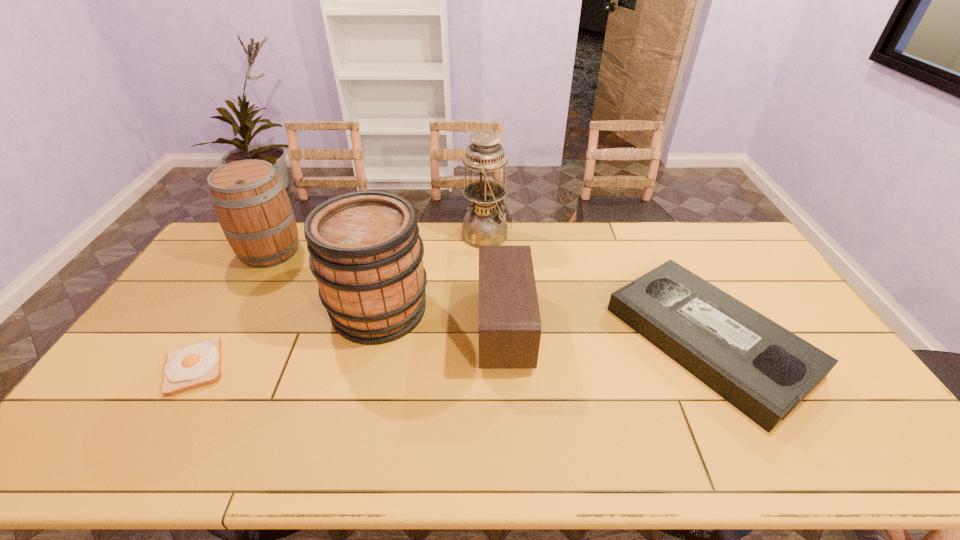
The image size is (960, 540). I want to click on toast located at the left edge, so click(188, 367).

The height and width of the screenshot is (540, 960). Find the location of `object present at the right edge`. object present at the right edge is located at coordinates (764, 370).

In order to click on object that is at the far left corner in this screenshot , I will do `click(252, 206)`.

Where is `object that is at the near right corner`? This screenshot has height=540, width=960. object that is at the near right corner is located at coordinates (764, 370).

Image resolution: width=960 pixels, height=540 pixels. In order to click on free space at the far edge of the desktop in this screenshot , I will do (543, 227).

The image size is (960, 540). In the image, there is a desktop. What are the coordinates of `vacant region at the near edge` in the screenshot? It's located at (446, 439).

Where is `blank space at the right edge of the desktop`? The image size is (960, 540). blank space at the right edge of the desktop is located at coordinates (790, 310).

At what (x,y) coordinates should I click in order to perform the action: click on blank region between the fourth object from right to left and the oil lamp. Please return your answer as a coordinate pair (x, y). The image size is (960, 540). Looking at the image, I should click on (433, 273).

The height and width of the screenshot is (540, 960). Identify the location of free space between the toast and the farther cider. (232, 309).

Identify the location of free space between the shortest object and the videotape. This screenshot has width=960, height=540. (451, 354).